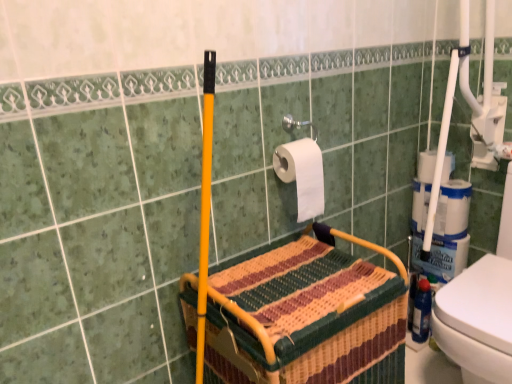
Question: Should I look upward or downward to see blue plastic bottle at lower right?

Choices:
 (A) down
 (B) up

Answer: (A)

Question: Considering the relative sizes of woven fabric basket at center and blue plastic bottle at lower right in the image provided, is woven fabric basket at center smaller than blue plastic bottle at lower right?

Choices:
 (A) no
 (B) yes

Answer: (A)

Question: Would you say woven fabric basket at center is outside blue plastic bottle at lower right?

Choices:
 (A) yes
 (B) no

Answer: (A)

Question: From the image's perspective, is woven fabric basket at center above blue plastic bottle at lower right?

Choices:
 (A) no
 (B) yes

Answer: (A)

Question: Considering the relative sizes of woven fabric basket at center and blue plastic bottle at lower right in the image provided, is woven fabric basket at center thinner than blue plastic bottle at lower right?

Choices:
 (A) no
 (B) yes

Answer: (A)

Question: Could you tell me if woven fabric basket at center is turned towards blue plastic bottle at lower right?

Choices:
 (A) yes
 (B) no

Answer: (B)

Question: Is woven fabric basket at center facing away from blue plastic bottle at lower right?

Choices:
 (A) no
 (B) yes

Answer: (A)

Question: Does white matte toilet paper at right, the first toilet paper positioned from the back, have a lesser height compared to woven fabric basket at center?

Choices:
 (A) yes
 (B) no

Answer: (A)

Question: Is white matte toilet paper at right, the 2th toilet paper positioned from the front, next to woven fabric basket at center?

Choices:
 (A) no
 (B) yes

Answer: (A)

Question: Is white matte toilet paper at right, which ranks as the 2th toilet paper in left-to-right order, positioned far away from woven fabric basket at center?

Choices:
 (A) no
 (B) yes

Answer: (A)

Question: From a real-world perspective, is white matte toilet paper at right, which ranks as the 2th toilet paper in left-to-right order, positioned over woven fabric basket at center based on gravity?

Choices:
 (A) yes
 (B) no

Answer: (A)

Question: Is white matte toilet paper at right, the first toilet paper positioned from the back, bigger than woven fabric basket at center?

Choices:
 (A) no
 (B) yes

Answer: (A)

Question: From a real-world perspective, is white matte toilet paper at right, which ranks as the 2th toilet paper in left-to-right order, physically below woven fabric basket at center?

Choices:
 (A) no
 (B) yes

Answer: (A)

Question: Is woven fabric basket at center thinner than white matte toilet paper at upper center, marked as the 1th toilet paper in a left-to-right arrangement?

Choices:
 (A) no
 (B) yes

Answer: (A)